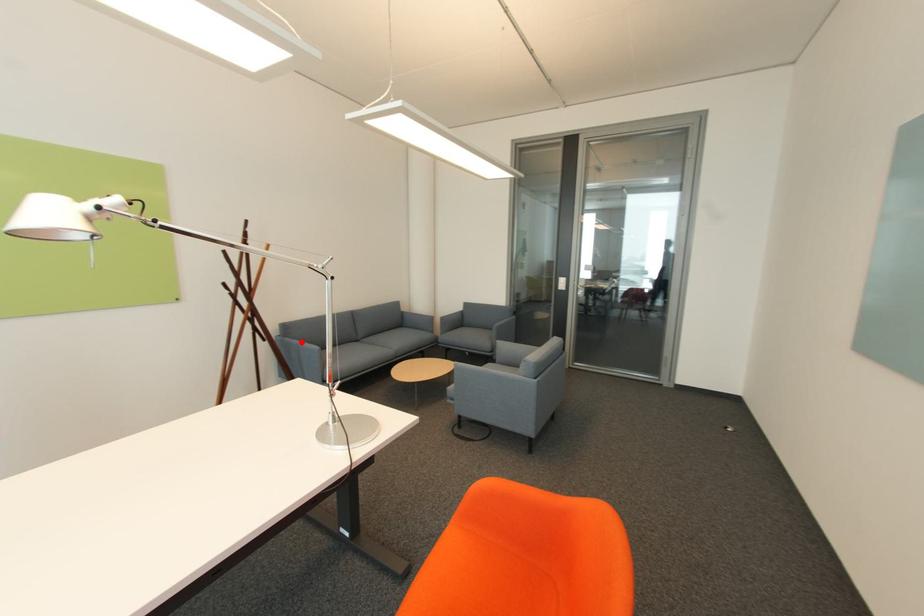
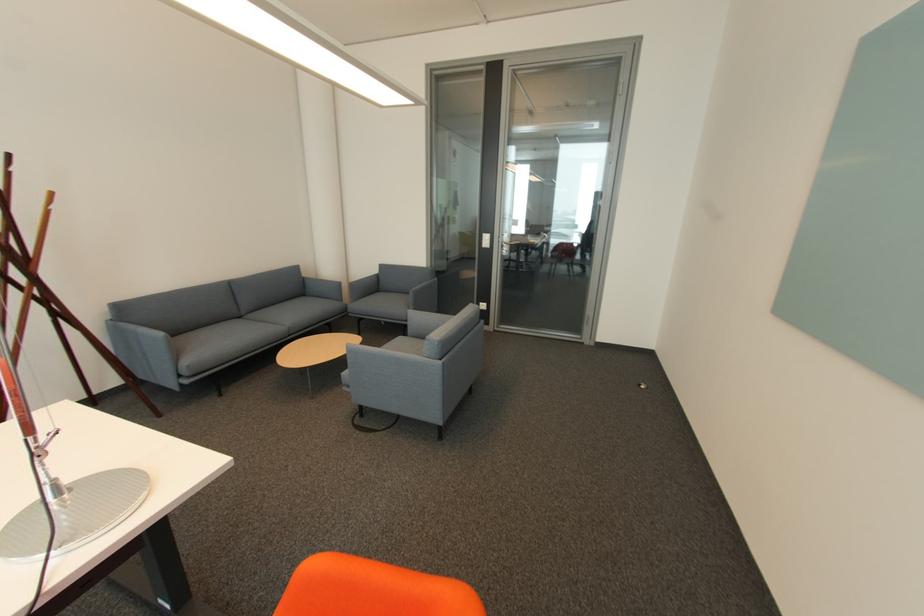
In the second image, find the point that corresponds to the highlighted location in the first image.

(139, 328)